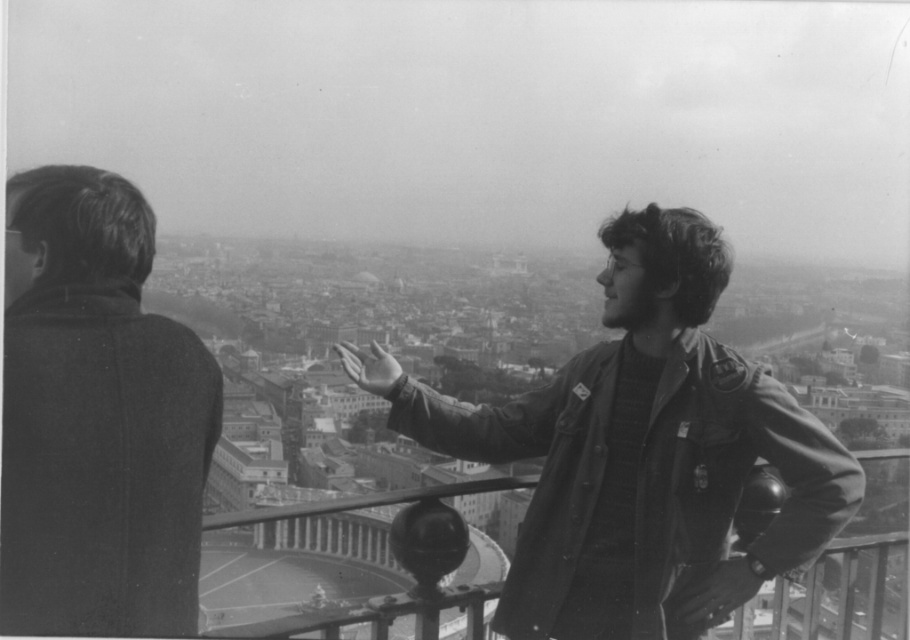
You are standing on a balcony overlooking a city and wearing a leather jacket at center. You want to throw a small pebble straight down towards the city below. Approximately how many seconds will it take for the pebble to hit the ground? Assume no air resistance.

The leather jacket at center and viewer are 68.20 meters apart. Assuming the distance from the balcony to the ground is 68.20 meters, the time can be calculated using the free fall equation t equals the square root of 2h over g. Plugging in h equals 68.20 meters and g equals 9.81 m per s squared, the time is approximately sqrt 2 times 68.20 divided by 9.81 equals sqrt 136.4 divided by 9.81 equals sqrt 13.9 equals about 3.73 seconds.

You are a tailor who needs to determine which garment requires more fabric to repair. Based on the scene, which garment between the leather jacket at center and the coarse wool coat at left would need more fabric?

The leather jacket at center is bigger than the coarse wool coat at left, so it would require more fabric to repair.